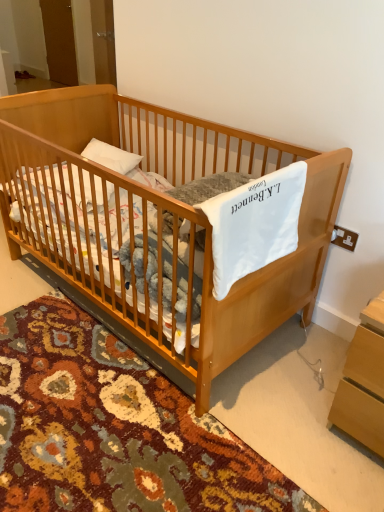
Question: Is point (3, 207) positioned closer to the camera than point (216, 259)?

Choices:
 (A) farther
 (B) closer

Answer: (A)

Question: Would you say light brown wooden crib at center is to the left or to the right of white soft blanket at center in the picture?

Choices:
 (A) left
 (B) right

Answer: (A)

Question: Which of these objects is positioned closest to the white soft blanket at center?

Choices:
 (A) light brown wooden crib at center
 (B) light brown wooden changing table at lower right

Answer: (A)

Question: Estimate the real-world distances between objects in this image. Which object is farther from the light brown wooden changing table at lower right?

Choices:
 (A) light brown wooden crib at center
 (B) white soft blanket at center

Answer: (A)